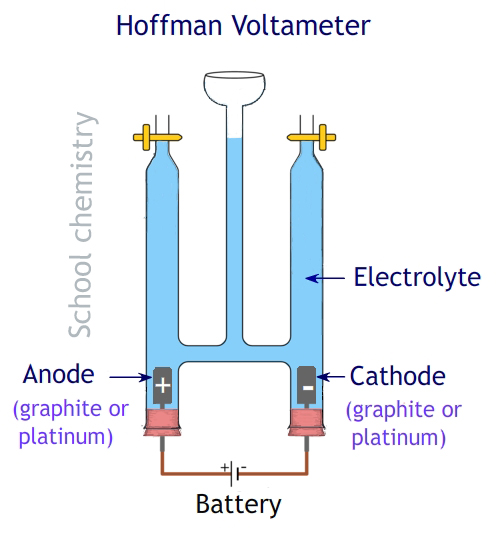
Find the location of `pink stopper`. pink stopper is located at coordinates (312, 428).